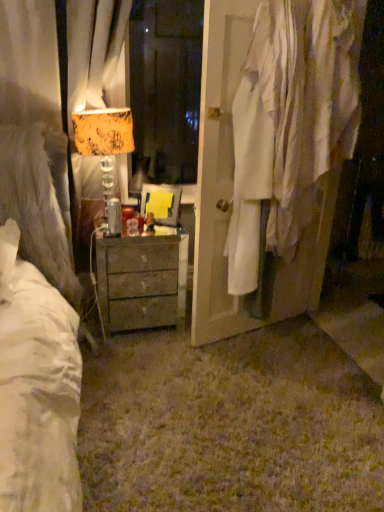
Question: Considering the relative sizes of orange-patterned fabric lampshade at left and white fabric at right in the image provided, is orange-patterned fabric lampshade at left bigger than white fabric at right?

Choices:
 (A) no
 (B) yes

Answer: (A)

Question: Is orange-patterned fabric lampshade at left in contact with white fabric at right?

Choices:
 (A) no
 (B) yes

Answer: (A)

Question: Is orange-patterned fabric lampshade at left completely or partially outside of white fabric at right?

Choices:
 (A) yes
 (B) no

Answer: (A)

Question: Does orange-patterned fabric lampshade at left have a lesser height compared to white fabric at right?

Choices:
 (A) yes
 (B) no

Answer: (A)

Question: From a real-world perspective, is orange-patterned fabric lampshade at left located higher than white fabric at right?

Choices:
 (A) no
 (B) yes

Answer: (A)

Question: Does orange-patterned fabric lampshade at left appear on the left side of white fabric at right?

Choices:
 (A) no
 (B) yes

Answer: (B)

Question: Is rustic wood chest of drawers at center far away from white fabric at right?

Choices:
 (A) yes
 (B) no

Answer: (B)

Question: From a real-world perspective, does rustic wood chest of drawers at center sit lower than white fabric at right?

Choices:
 (A) yes
 (B) no

Answer: (A)

Question: From the image's perspective, is rustic wood chest of drawers at center located above white fabric at right?

Choices:
 (A) yes
 (B) no

Answer: (B)

Question: From a real-world perspective, is rustic wood chest of drawers at center on top of white fabric at right?

Choices:
 (A) yes
 (B) no

Answer: (B)

Question: Can you confirm if rustic wood chest of drawers at center is shorter than white fabric at right?

Choices:
 (A) no
 (B) yes

Answer: (B)

Question: Is rustic wood chest of drawers at center completely or partially outside of white fabric at right?

Choices:
 (A) no
 (B) yes

Answer: (B)

Question: From a real-world perspective, is orange-patterned fabric lampshade at left physically below rustic wood chest of drawers at center?

Choices:
 (A) yes
 (B) no

Answer: (B)